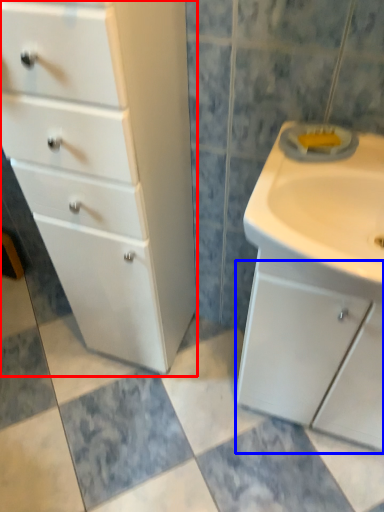
Question: Which object is further to the camera taking this photo, chest of drawers (highlighted by a red box) or cabinetry (highlighted by a blue box)?

Choices:
 (A) chest of drawers
 (B) cabinetry

Answer: (B)